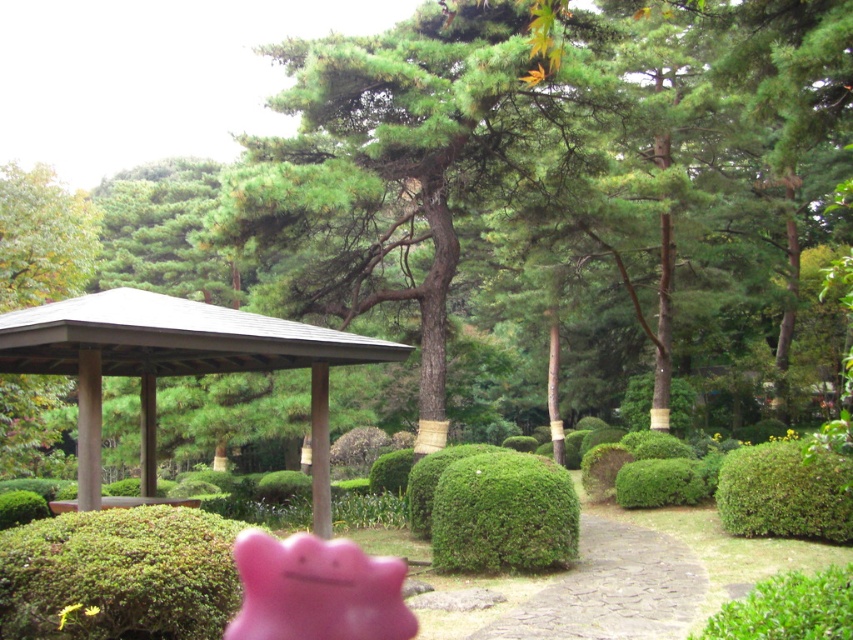
You are standing in the Japanese garden and see two points marked in the scene. Which point is closer to you, point [376,349] or point [310,548]?

Point [376,349] is closer to you because it is further to the viewer than point [310,548].

You are standing in the garden scene and want to locate the brown wooden gazebo at center. According to the coordinates provided, where would you find it?

The brown wooden gazebo at center is located at the 2D coordinates point (173, 365).

Looking at this image, you are a gardener planning to plant a row of flowers between the green matte hedge at lower left and the green matte hedge at center. Which hedge should you choose to plant closer to if you want the flowers to have more space?

The green matte hedge at lower left might be wider than the green matte hedge at center, so planting closer to the green matte hedge at lower left would provide more space for the flowers.